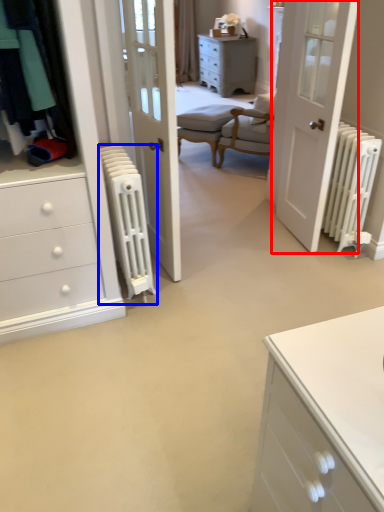
Question: Which of the following is the closest to the observer, door (highlighted by a red box) or radiator (highlighted by a blue box)?

Choices:
 (A) door
 (B) radiator

Answer: (B)